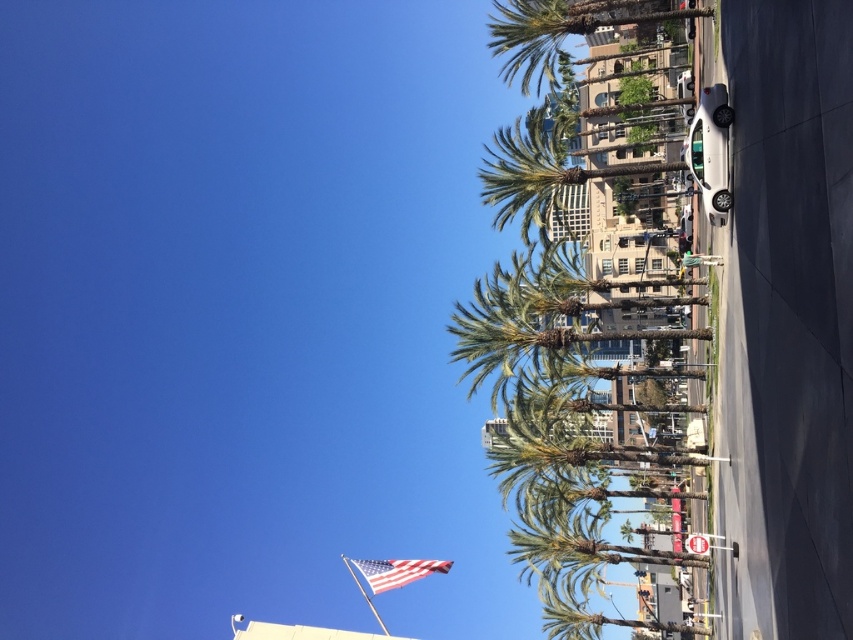
In the scene shown: You are standing on the sidewalk and want to take a photo of the american flag at center without the green leafy palm tree at center blocking it. How should you adjust your position?

Move closer to the american flag at center so that the green leafy palm tree at center is no longer in front of it.

You are standing on the sidewalk and want to take a photo of the green leafy palm tree at upper center. Where should you position yourself to capture the tree in the center of your camera view?

To capture the green leafy palm tree at upper center in the center of your camera view, position yourself directly in front of the tree at its coordinates point (x=561, y=29).

In the scene shown: You are a delivery drone flying above the street. You need to deliver a package to a building behind the palm trees. To avoid hitting the trees, you must fly between the green leafy palm tree at center and the green leafy palm tree at upper center. Is there enough space for your drone, which has a wingspan of 1.2 meters?

The distance between the green leafy palm tree at center and the green leafy palm tree at upper center is 8.90 meters, so yes, the drone can safely fly between them as the space is more than sufficient for its 1.2 meter wingspan.